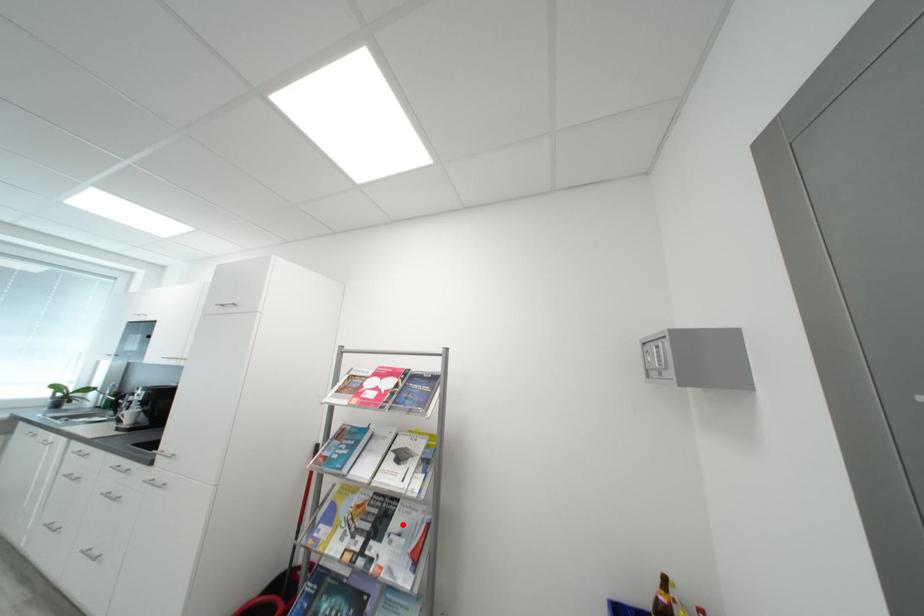
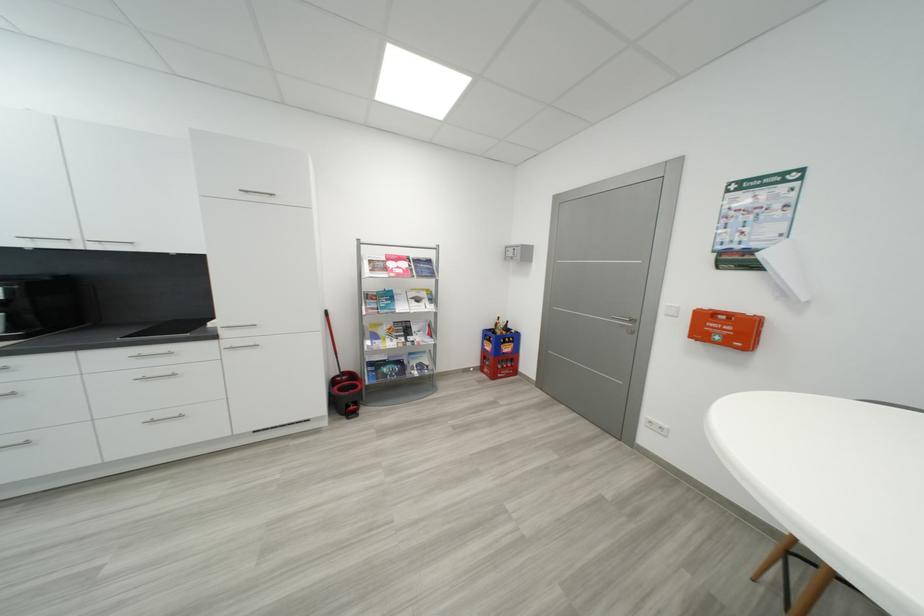
The point at the highlighted location is marked in the first image. Where is the corresponding point in the second image?

(421, 330)